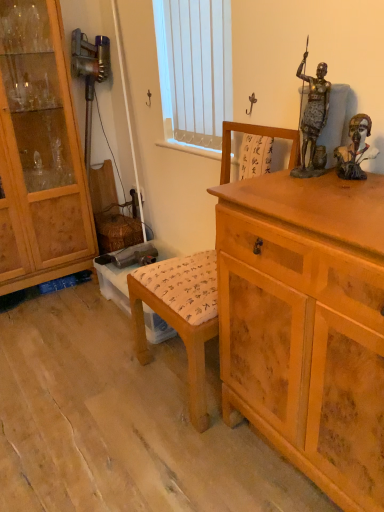
Question: Is wooden chair at center facing towards light brown wood cabinet at left?

Choices:
 (A) yes
 (B) no

Answer: (B)

Question: Is wooden chair at center wider than light brown wood cabinet at left?

Choices:
 (A) yes
 (B) no

Answer: (A)

Question: Is the position of wooden chair at center less distant than that of light brown wood cabinet at left?

Choices:
 (A) no
 (B) yes

Answer: (B)

Question: Can you confirm if wooden chair at center is positioned to the left of light brown wood cabinet at left?

Choices:
 (A) no
 (B) yes

Answer: (A)

Question: Can you confirm if wooden chair at center is shorter than light brown wood cabinet at left?

Choices:
 (A) yes
 (B) no

Answer: (A)

Question: Based on their positions, is bronze statue at upper right, the second person viewed from the right, located to the left or right of brown wooden bust at upper right, the first person when ordered from right to left?

Choices:
 (A) right
 (B) left

Answer: (B)

Question: Considering the positions of point (309, 86) and point (352, 179), is point (309, 86) closer or farther from the camera than point (352, 179)?

Choices:
 (A) farther
 (B) closer

Answer: (A)

Question: Is bronze statue at upper right, the second person viewed from the right, wider or thinner than brown wooden bust at upper right, marked as the 2th person in a left-to-right arrangement?

Choices:
 (A) thin
 (B) wide

Answer: (B)

Question: Would you say bronze statue at upper right, which is the first person from left to right, is inside or outside brown wooden bust at upper right, marked as the 2th person in a left-to-right arrangement?

Choices:
 (A) outside
 (B) inside

Answer: (A)

Question: Does point (163, 28) appear closer or farther from the camera than point (91, 260)?

Choices:
 (A) closer
 (B) farther

Answer: (A)

Question: From a real-world perspective, relative to light brown wood cabinet at left, is white vertical blinds at upper center vertically above or below?

Choices:
 (A) below
 (B) above

Answer: (B)

Question: Considering the positions of white vertical blinds at upper center and light brown wood cabinet at left in the image, is white vertical blinds at upper center wider or thinner than light brown wood cabinet at left?

Choices:
 (A) wide
 (B) thin

Answer: (B)

Question: From the image's perspective, is white vertical blinds at upper center located above or below light brown wood cabinet at left?

Choices:
 (A) above
 (B) below

Answer: (A)

Question: Looking at their shapes, would you say light brown wooden chest of drawers at right is wider or thinner than light brown wood cabinet at left?

Choices:
 (A) thin
 (B) wide

Answer: (B)

Question: Is point tap(314, 336) closer or farther from the camera than point tap(31, 138)?

Choices:
 (A) farther
 (B) closer

Answer: (B)